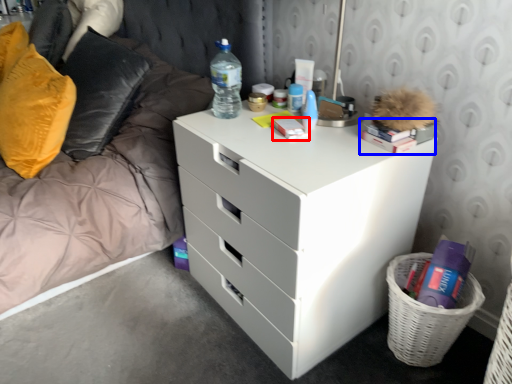
Question: Which object is further to the camera taking this photo, book (highlighted by a red box) or book (highlighted by a blue box)?

Choices:
 (A) book
 (B) book

Answer: (A)